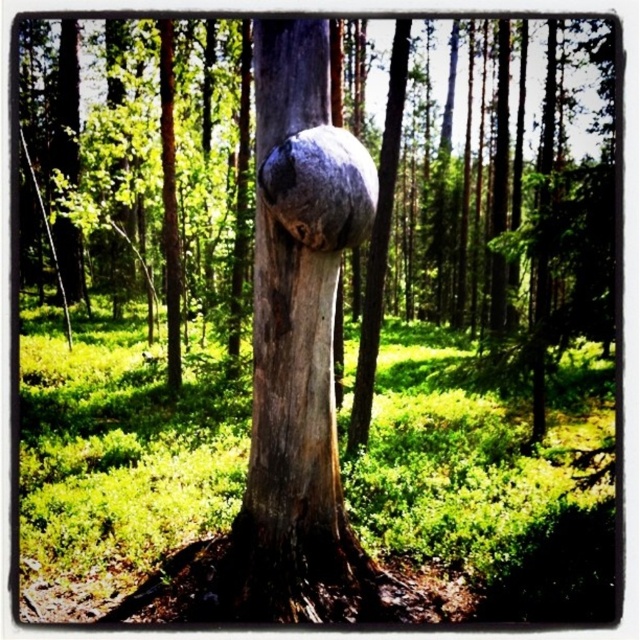
You are a hiker who has stumbled upon this forest scene. You need to identify the location of the smooth gray bark at center relative to the gray rough stone at center. Can you tell me which one is positioned to the left?

The smooth gray bark at center is to the left of the gray rough stone at center.

You are standing at point A and want to reach point B in the forest. The path between them is blocked by dense undergrowth. If point A is at point (250, 131) and point B is at point (355, 237), which point should you start from to reach the other without going through the thick vegetation?

Point (250, 131) is behind point (355, 237). Therefore, you should start from point (355, 237) and move towards point (250, 131) to avoid the dense undergrowth between them.